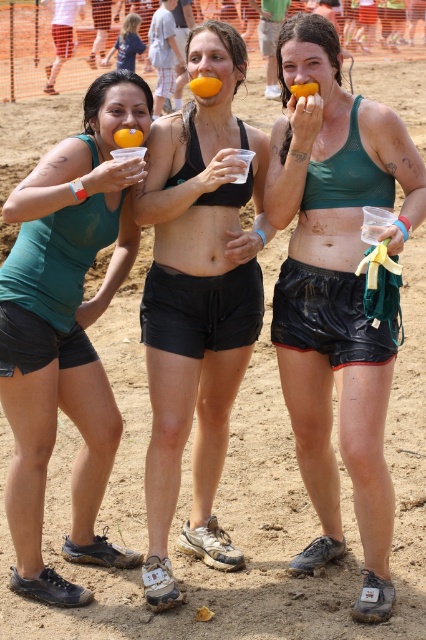
You are a photographer standing at the center of the obstacle course. You want to take a photo that includes both the point at coordinates point (69, 269) and point (221, 84). Which point should you focus on first to ensure both are in the frame?

You should focus on point (69, 269) first because it is closer to the viewer than point (221, 84), ensuring both points are within the camera frame.

You are a photographer positioned at the starting line of the mud run course. You need to capture a closeup shot of the matte teal tank top at left. Given that your camera can focus on objects within 10 feet, will you be able to take the photo without moving closer?

The matte teal tank top at left is 11.69 feet away from the viewer, which is beyond the camera focus range of 10 feet. Therefore, you cannot take the closeup shot without moving closer.